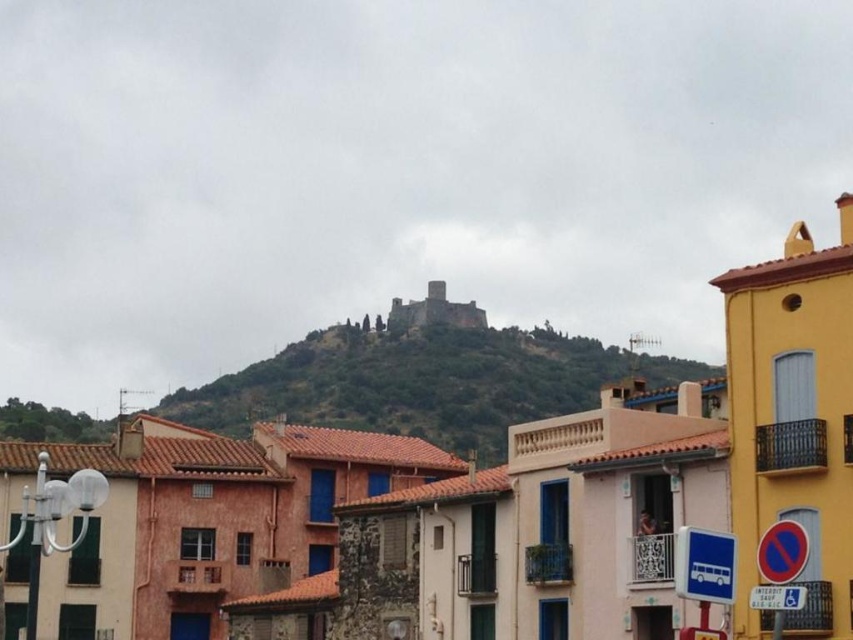
Question: Does terracotta clay roof tiles at upper center come in front of green grassy hillside at center?

Choices:
 (A) yes
 (B) no

Answer: (A)

Question: Which point is farther to the camera?

Choices:
 (A) (390, 401)
 (B) (834, 627)

Answer: (A)

Question: Can you confirm if terracotta clay roof tiles at upper center is positioned to the right of green grassy hillside at center?

Choices:
 (A) no
 (B) yes

Answer: (B)

Question: Is terracotta clay roof tiles at upper center positioned before green grassy hillside at center?

Choices:
 (A) yes
 (B) no

Answer: (A)

Question: Among these points, which one is farthest from the camera?

Choices:
 (A) (296, 452)
 (B) (33, 433)

Answer: (B)